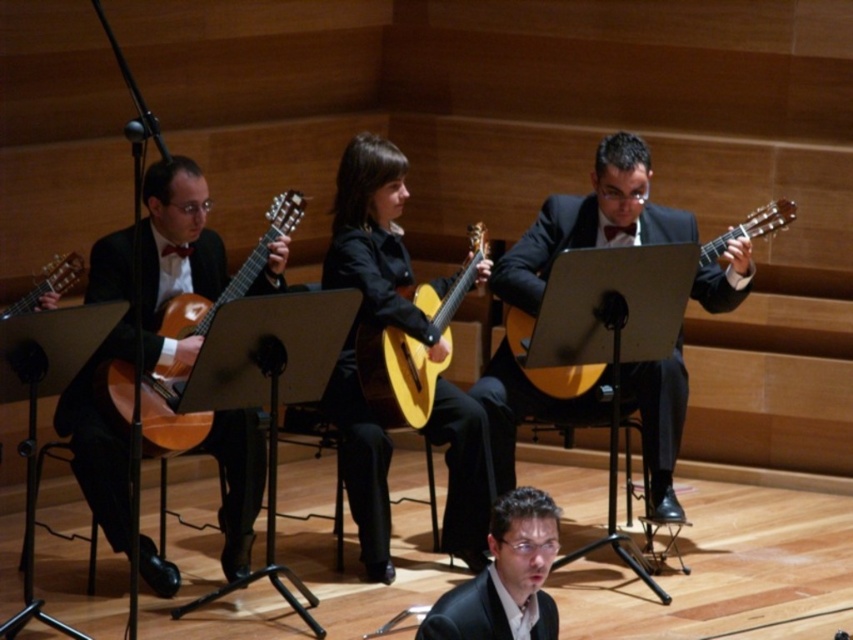
Which is in front, point (610, 168) or point (117, 408)?

Point (117, 408) is in front.

Can you confirm if shiny black suit at center is taller than matte wood guitar at left?

Yes.

Describe the element at coordinates (590, 221) in the screenshot. I see `shiny black suit at center` at that location.

The width and height of the screenshot is (853, 640). In order to click on shiny black suit at center in this screenshot , I will do `click(590, 221)`.

Is shiny black guitar at left positioned at the back of yellow matte guitar at center?

No, it is not.

Who is more forward, (131, 264) or (418, 356)?

Point (131, 264) is in front.

Between point (187, 266) and point (457, 305), which one is positioned behind?

Positioned behind is point (457, 305).

Where is `shiny black guitar at left`? Image resolution: width=853 pixels, height=640 pixels. shiny black guitar at left is located at coordinates (177, 252).

Does shiny black guitar at left have a larger size compared to matte wood guitar at center?

Yes, shiny black guitar at left is bigger than matte wood guitar at center.

Does point (91, 244) come behind point (544, 369)?

No, (91, 244) is closer to viewer.

Who is more distant from viewer, (115, 492) or (701, 257)?

The point (701, 257) is behind.

Locate an element on the screen. The width and height of the screenshot is (853, 640). shiny black guitar at left is located at coordinates pyautogui.click(x=177, y=252).